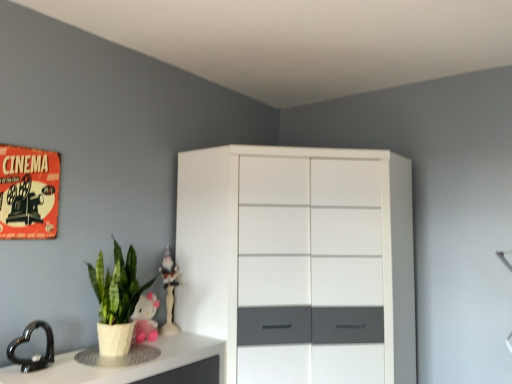
Question: Is pink plush toy at lower left, marked as the 1th toy in a front-to-back arrangement, thinner than white glossy cabinet at center?

Choices:
 (A) no
 (B) yes

Answer: (B)

Question: Could you tell me if pink plush toy at lower left, the 2th toy viewed from the back, is facing white glossy cabinet at center?

Choices:
 (A) no
 (B) yes

Answer: (A)

Question: Does pink plush toy at lower left, the 2th toy viewed from the back, have a smaller size compared to white glossy cabinet at center?

Choices:
 (A) no
 (B) yes

Answer: (B)

Question: Is there a large distance between pink plush toy at lower left, the 2th toy viewed from the back, and white glossy cabinet at center?

Choices:
 (A) yes
 (B) no

Answer: (B)

Question: Is the depth of pink plush toy at lower left, marked as the 1th toy in a front-to-back arrangement, less than that of white glossy cabinet at center?

Choices:
 (A) yes
 (B) no

Answer: (B)

Question: Does pink plush toy at lower left, marked as the 1th toy in a front-to-back arrangement, have a larger size compared to white glossy cabinet at center?

Choices:
 (A) no
 (B) yes

Answer: (A)

Question: Is the position of white glossy counter top at lower left less distant than that of white glossy cabinet at center?

Choices:
 (A) yes
 (B) no

Answer: (A)

Question: Is white glossy counter top at lower left to the right of white glossy cabinet at center from the viewer's perspective?

Choices:
 (A) yes
 (B) no

Answer: (B)

Question: From the image's perspective, is white glossy counter top at lower left on top of white glossy cabinet at center?

Choices:
 (A) no
 (B) yes

Answer: (A)

Question: Is white glossy counter top at lower left completely or partially outside of white glossy cabinet at center?

Choices:
 (A) no
 (B) yes

Answer: (B)

Question: From a real-world perspective, is white glossy counter top at lower left located beneath white glossy cabinet at center?

Choices:
 (A) no
 (B) yes

Answer: (B)

Question: Considering the relative sizes of white glossy counter top at lower left and white glossy cabinet at center in the image provided, is white glossy counter top at lower left bigger than white glossy cabinet at center?

Choices:
 (A) yes
 (B) no

Answer: (B)

Question: Is there a large distance between pink plush toy at lower left, the 2th toy viewed from the back, and white glossy counter top at lower left?

Choices:
 (A) no
 (B) yes

Answer: (A)